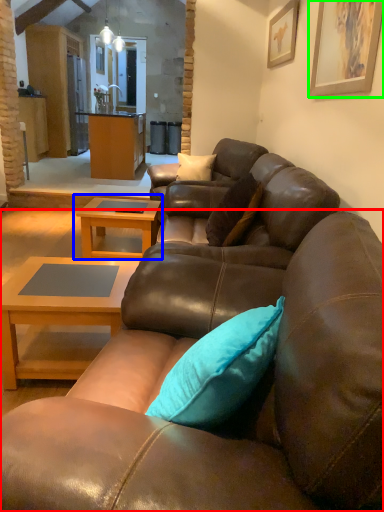
Question: Estimate the real-world distances between objects in this image. Which object is closer to studio couch (highlighted by a red box), coffee table (highlighted by a blue box) or picture frame (highlighted by a green box)?

Choices:
 (A) coffee table
 (B) picture frame

Answer: (B)